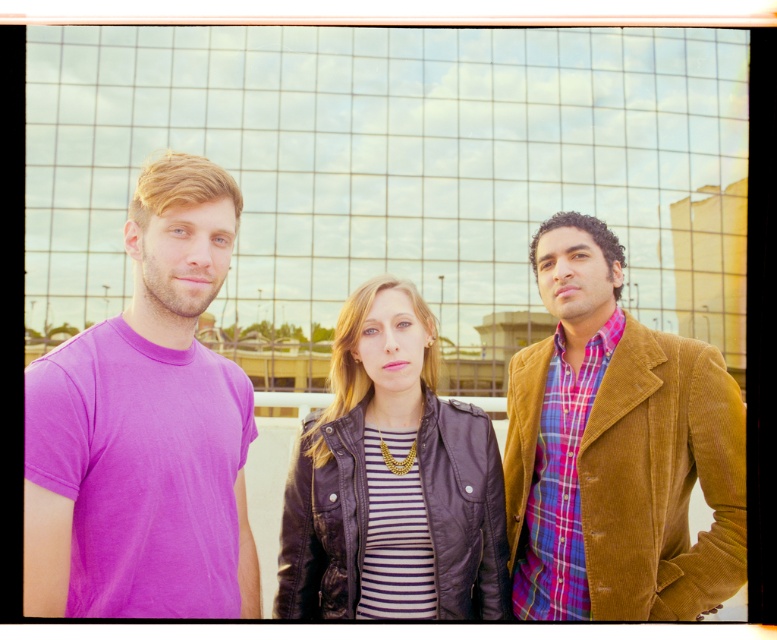
Question: Considering the relative positions of purple cotton t-shirt at left and leather jacket at center in the image provided, where is purple cotton t-shirt at left located with respect to leather jacket at center?

Choices:
 (A) below
 (B) above

Answer: (B)

Question: Among these points, which one is nearest to the camera?

Choices:
 (A) [423, 586]
 (B) [647, 432]

Answer: (A)

Question: Is purple cotton t-shirt at left positioned behind corduroy jacket at right?

Choices:
 (A) no
 (B) yes

Answer: (A)

Question: Among these objects, which one is nearest to the camera?

Choices:
 (A) leather jacket at center
 (B) corduroy jacket at right
 (C) purple cotton t-shirt at left

Answer: (C)

Question: Can you confirm if corduroy jacket at right is wider than leather jacket at center?

Choices:
 (A) no
 (B) yes

Answer: (A)

Question: Which object is closer to the camera taking this photo?

Choices:
 (A) corduroy jacket at right
 (B) purple cotton t-shirt at left

Answer: (B)